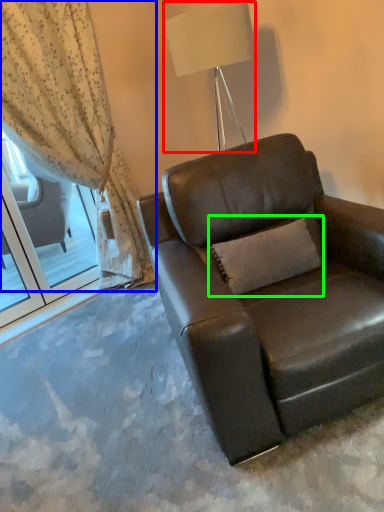
Question: Which object is positioned closest to lamp (highlighted by a red box)? Select from curtain (highlighted by a blue box) and pillow (highlighted by a green box).

Choices:
 (A) curtain
 (B) pillow

Answer: (A)